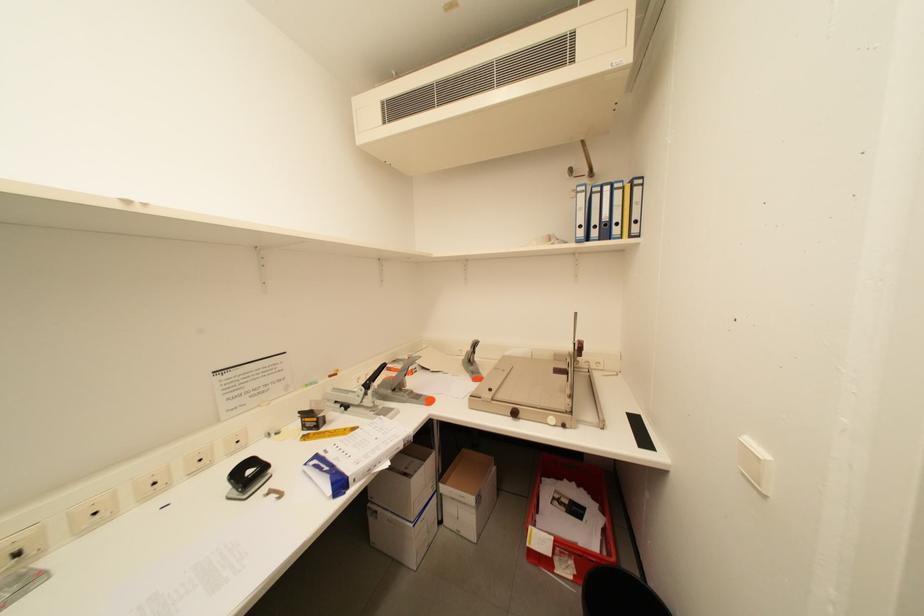
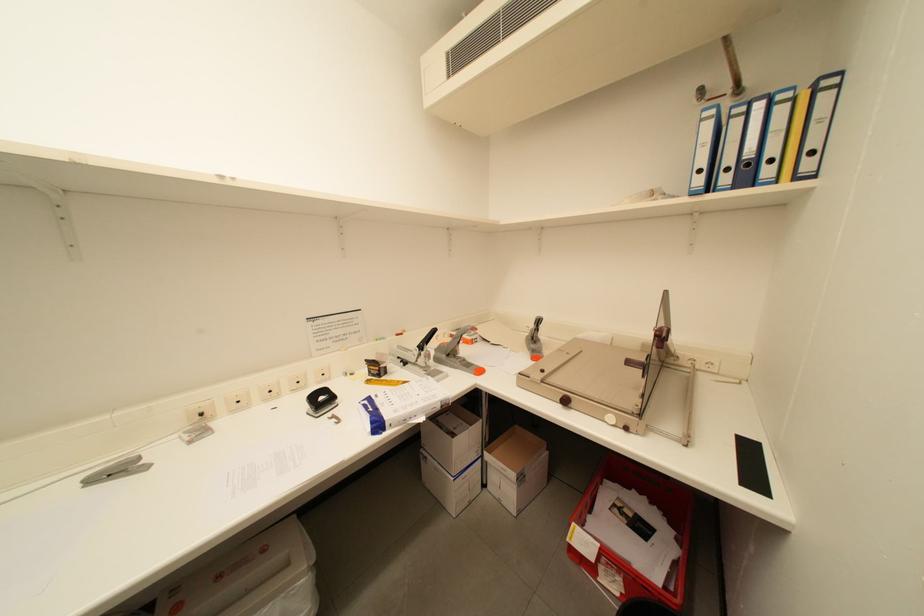
Which direction would the cameraman need to move to produce the second image?

The cameraman moved toward right, forward.